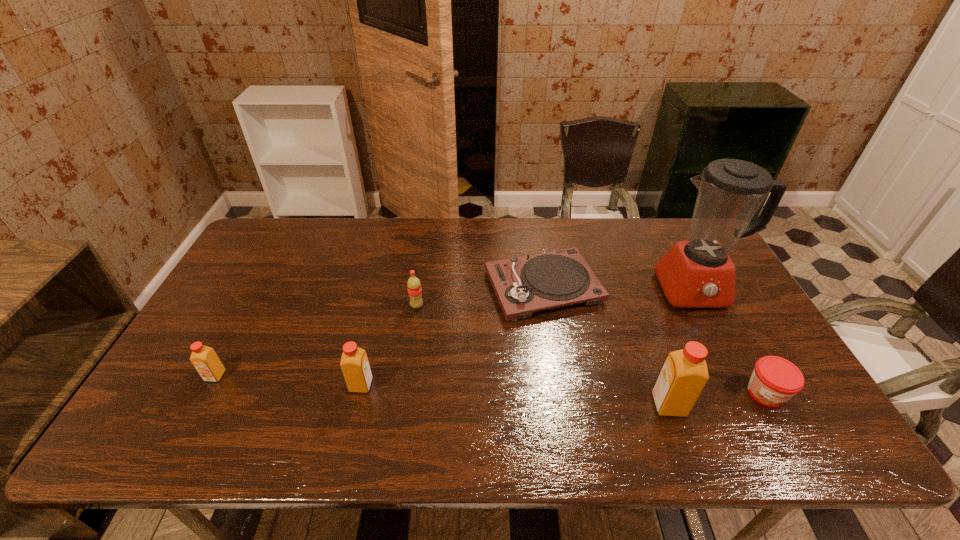
Identify the location of the leftmost orange juice. This screenshot has height=540, width=960. (205, 360).

Locate an element on the screen. the leftmost object is located at coordinates (205, 360).

Locate an element on the screen. The height and width of the screenshot is (540, 960). the second tallest orange juice is located at coordinates (354, 363).

Identify the location of the second object from left to right. (354, 363).

What are the coordinates of `the rightmost orange juice` in the screenshot? It's located at (684, 375).

Find the location of `the tallest orange juice`. the tallest orange juice is located at coordinates (684, 375).

Identify the location of the tallest object. The image size is (960, 540). (698, 273).

I want to click on soda, so click(413, 284).

The height and width of the screenshot is (540, 960). Identify the location of phonograph_record. (523, 285).

You are a GUI agent. You are given a task and a screenshot of the screen. Output one action in this format:
    pyautogui.click(x=<x>, y=<y>)
    Task: Click on the fourth object from left to right
    
    Given the screenshot: What is the action you would take?
    pyautogui.click(x=523, y=285)